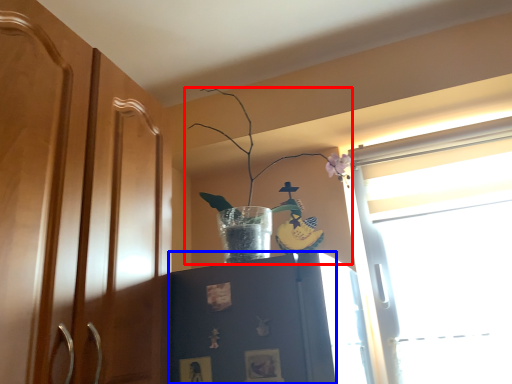
Question: Which of the following is the closest to the observer, houseplant (highlighted by a red box) or cabinetry (highlighted by a blue box)?

Choices:
 (A) houseplant
 (B) cabinetry

Answer: (B)